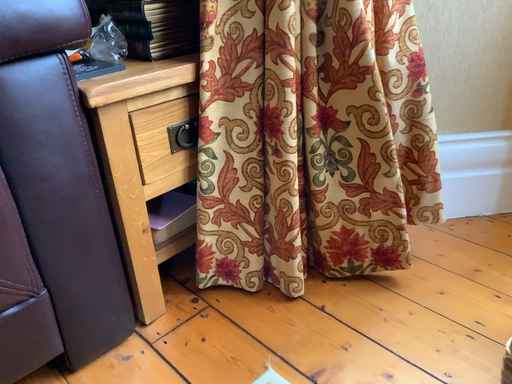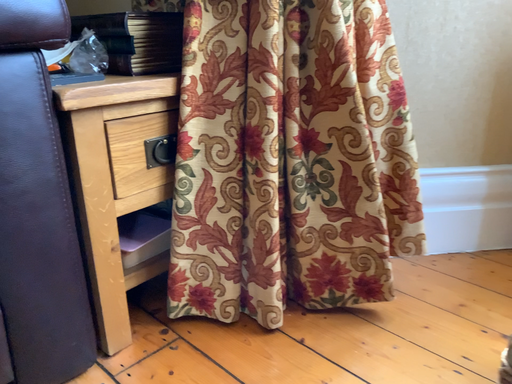
Question: Which way did the camera rotate in the video?

Choices:
 (A) rotated upward
 (B) rotated downward

Answer: (A)